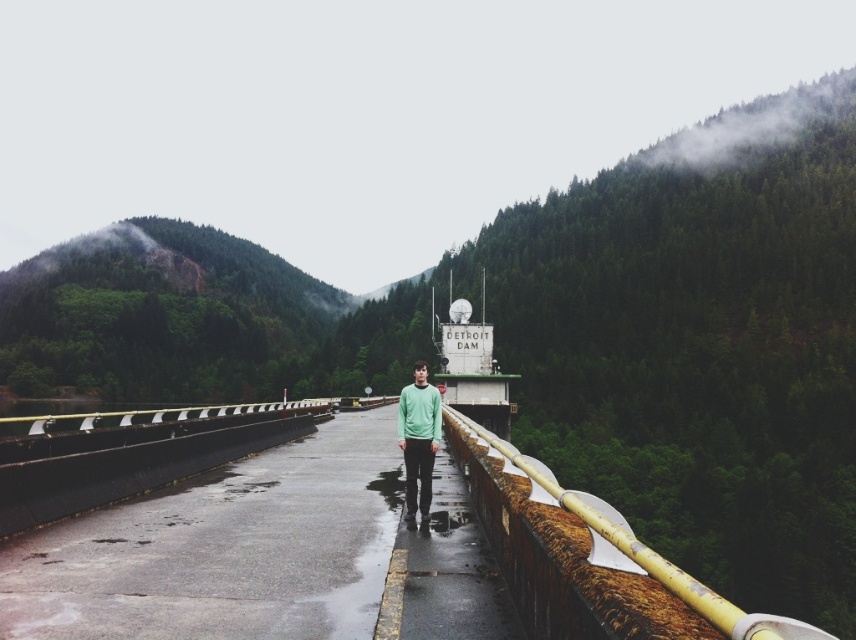
Question: Which point is closer to the camera?

Choices:
 (A) green matte sweater at center
 (B) rusty metal railing at center

Answer: (B)

Question: Can you confirm if rusty metal railing at center is positioned to the right of green matte sweater at center?

Choices:
 (A) yes
 (B) no

Answer: (A)

Question: Is rusty metal railing at center to the left of green matte sweater at center from the viewer's perspective?

Choices:
 (A) no
 (B) yes

Answer: (A)

Question: Which object is farther from the camera taking this photo?

Choices:
 (A) rusty metal railing at center
 (B) green matte sweater at center

Answer: (B)

Question: Does rusty metal railing at center have a smaller size compared to green matte sweater at center?

Choices:
 (A) no
 (B) yes

Answer: (A)